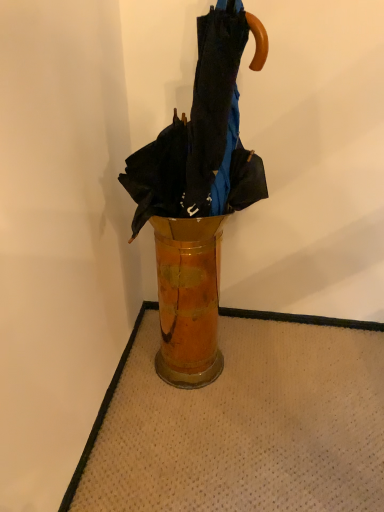
I want to click on shiny metallic umbrella at center, so click(x=202, y=135).

What is the approximate height of shiny metallic umbrella at center?

shiny metallic umbrella at center is 51.06 centimeters in height.

What do you see at coordinates (202, 135) in the screenshot?
I see `shiny metallic umbrella at center` at bounding box center [202, 135].

What do you see at coordinates (188, 298) in the screenshot?
I see `wooden vase at center` at bounding box center [188, 298].

You are a GUI agent. You are given a task and a screenshot of the screen. Output one action in this format:
    pyautogui.click(x=<x>, y=<y>)
    Task: Click on the wooden vase at center
    Image resolution: width=384 pixels, height=512 pixels.
    Given the screenshot: What is the action you would take?
    pyautogui.click(x=188, y=298)

You are a GUI agent. You are given a task and a screenshot of the screen. Output one action in this format:
    pyautogui.click(x=<x>, y=<y>)
    Task: Click on the shiny metallic umbrella at center
    
    Given the screenshot: What is the action you would take?
    pyautogui.click(x=202, y=135)

Is shiny metallic umbrella at center at the right side of wooden vase at center?

Yes.

In the image, is shiny metallic umbrella at center positioned in front of or behind wooden vase at center?

In the image, shiny metallic umbrella at center appears in front of wooden vase at center.

Does point (222, 132) appear closer or farther from the camera than point (167, 264)?

Point (222, 132) is positioned closer to the camera compared to point (167, 264).

From the image's perspective, is shiny metallic umbrella at center located above wooden vase at center?

Yes, from the image's perspective, shiny metallic umbrella at center is over wooden vase at center.

From a real-world perspective, is shiny metallic umbrella at center positioned above or below wooden vase at center?

In terms of real-world spatial position, shiny metallic umbrella at center is above wooden vase at center.

Can you confirm if shiny metallic umbrella at center is thinner than wooden vase at center?

No, shiny metallic umbrella at center is not thinner than wooden vase at center.

Can you confirm if shiny metallic umbrella at center is taller than wooden vase at center?

Yes, shiny metallic umbrella at center is taller than wooden vase at center.

Considering the relative sizes of shiny metallic umbrella at center and wooden vase at center in the image provided, is shiny metallic umbrella at center smaller than wooden vase at center?

No, shiny metallic umbrella at center is not smaller than wooden vase at center.

Can we say shiny metallic umbrella at center lies outside wooden vase at center?

Yes, shiny metallic umbrella at center is located beyond the bounds of wooden vase at center.

Is the surface of shiny metallic umbrella at center in direct contact with wooden vase at center?

No, shiny metallic umbrella at center is not with wooden vase at center.

Is wooden vase at center at the back of shiny metallic umbrella at center?

No, shiny metallic umbrella at center is not facing away from wooden vase at center.

Can you tell me how much shiny metallic umbrella at center and wooden vase at center differ in facing direction?

0.000444 degrees separate the facing orientations of shiny metallic umbrella at center and wooden vase at center.

Image resolution: width=384 pixels, height=512 pixels. I want to click on umbrella above the wooden vase at center (from a real-world perspective), so click(202, 135).

In the image, is wooden vase at center on the left side or the right side of shiny metallic umbrella at center?

In the image, wooden vase at center appears on the left side of shiny metallic umbrella at center.

Who is more distant, wooden vase at center or shiny metallic umbrella at center?

wooden vase at center is behind.

Between point (184, 373) and point (211, 11), which one is positioned behind?

Point (184, 373)

From the image's perspective, would you say wooden vase at center is positioned over shiny metallic umbrella at center?

No, from the image's perspective, wooden vase at center is not above shiny metallic umbrella at center.

From a real-world perspective, does wooden vase at center sit lower than shiny metallic umbrella at center?

Yes, from a real-world perspective, wooden vase at center is under shiny metallic umbrella at center.

Is wooden vase at center thinner than shiny metallic umbrella at center?

Correct, the width of wooden vase at center is less than that of shiny metallic umbrella at center.

Considering the sizes of objects wooden vase at center and shiny metallic umbrella at center in the image provided, who is shorter, wooden vase at center or shiny metallic umbrella at center?

wooden vase at center.

Is wooden vase at center smaller than shiny metallic umbrella at center?

Indeed, wooden vase at center has a smaller size compared to shiny metallic umbrella at center.

Would you say wooden vase at center is inside or outside shiny metallic umbrella at center?

wooden vase at center cannot be found inside shiny metallic umbrella at center.

Are wooden vase at center and shiny metallic umbrella at center far apart?

No, there isn't a large distance between wooden vase at center and shiny metallic umbrella at center.

From the picture: Is shiny metallic umbrella at center at the back of wooden vase at center?

wooden vase at center does not have its back to shiny metallic umbrella at center.

Consider the image. Measure the distance from wooden vase at center to shiny metallic umbrella at center.

They are 19.49 centimeters apart.

Identify the location of vase that appears below the shiny metallic umbrella at center (from a real-world perspective). (188, 298).

I want to click on vase below the shiny metallic umbrella at center (from a real-world perspective), so click(x=188, y=298).

Where is `umbrella in front of the wooden vase at center`? Image resolution: width=384 pixels, height=512 pixels. umbrella in front of the wooden vase at center is located at coordinates (202, 135).